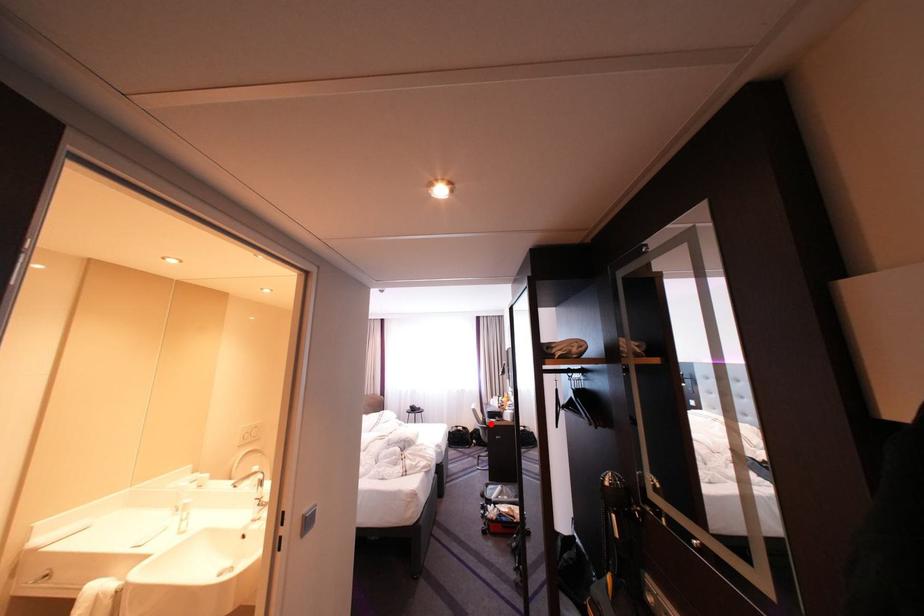
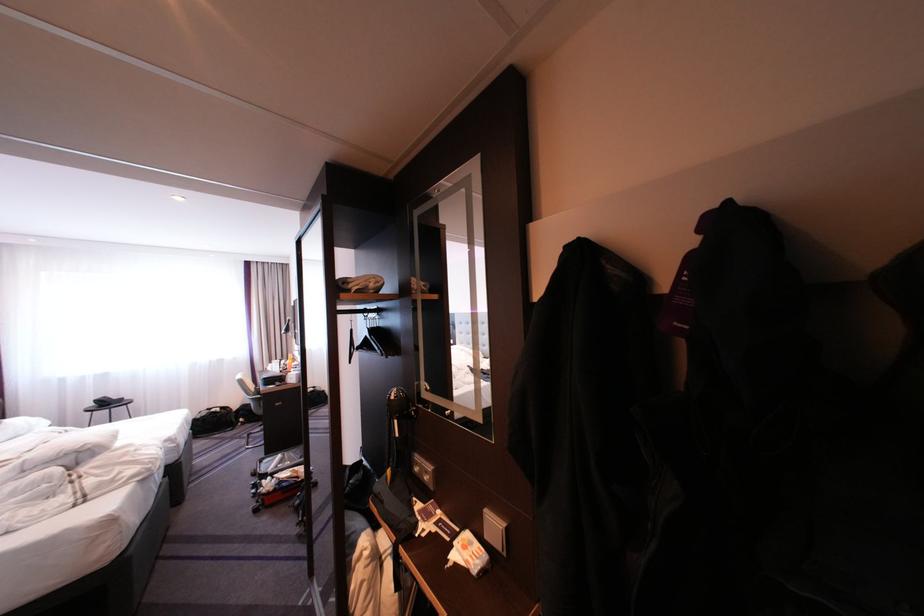
Find the pixel in the second image that matches the highlighted location in the first image.

(261, 395)